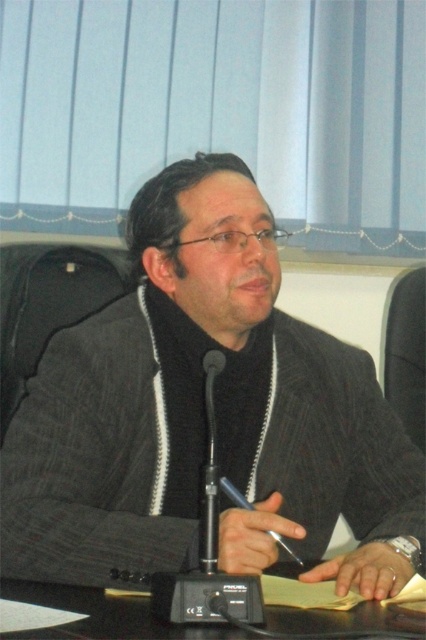
Is black glossy table at center closer to camera compared to black metallic microphone at center?

That is True.

Who is more forward, (115,620) or (206,396)?

Positioned in front is point (115,620).

The width and height of the screenshot is (426, 640). Identify the location of black glossy table at center. (92, 616).

How far apart are dark gray textured blazer at center and black glossy table at center?

dark gray textured blazer at center and black glossy table at center are 10.04 inches apart from each other.

Locate an element on the screen. Image resolution: width=426 pixels, height=640 pixels. dark gray textured blazer at center is located at coordinates (204, 413).

Locate an element on the screen. This screenshot has height=640, width=426. dark gray textured blazer at center is located at coordinates [x=204, y=413].

Which is above, dark gray textured blazer at center or black metallic microphone at center?

dark gray textured blazer at center is higher up.

Which is behind, point (37, 467) or point (209, 496)?

Point (37, 467)

The height and width of the screenshot is (640, 426). Identify the location of dark gray textured blazer at center. (204, 413).